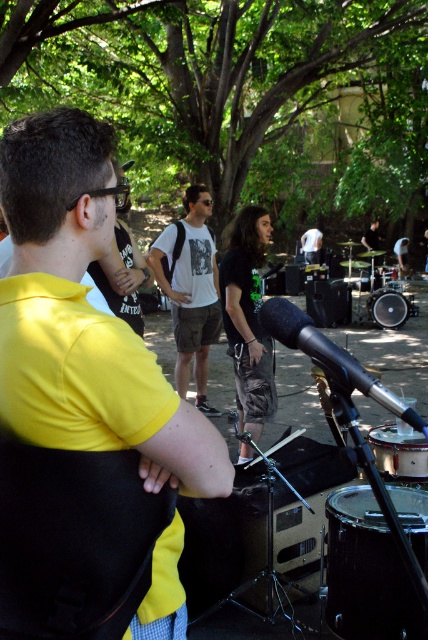
Does yellow matte shirt at center have a lesser height compared to black drum at center?

Incorrect, yellow matte shirt at center's height does not fall short of black drum at center's.

Who is shorter, yellow matte shirt at center or black drum at center?

black drum at center

Which is in front, point (204, 452) or point (404, 300)?

Point (204, 452)

You are a GUI agent. You are given a task and a screenshot of the screen. Output one action in this format:
    pyautogui.click(x=<x>, y=<y>)
    Task: Click on the yellow matte shirt at center
    This screenshot has height=640, width=428.
    Given the screenshot: What is the action you would take?
    pyautogui.click(x=83, y=317)

Is white cotton t-shirt at center behind black drum at center?

That is False.

Is point (184, 240) less distant than point (383, 323)?

That is True.

Identify the location of white cotton t-shirt at center. The height and width of the screenshot is (640, 428). (190, 291).

In the scene shown: Between white cotton t-shirt at center and green camouflage pants at center, which one has less height?

green camouflage pants at center

Can you confirm if white cotton t-shirt at center is thinner than green camouflage pants at center?

No.

Is point (205, 237) farther from camera compared to point (315, 243)?

No, (205, 237) is in front of (315, 243).

At what (x,y) coordinates should I click in order to perform the action: click on white cotton t-shirt at center. Please return your answer as a coordinate pair (x, y). Looking at the image, I should click on (190, 291).